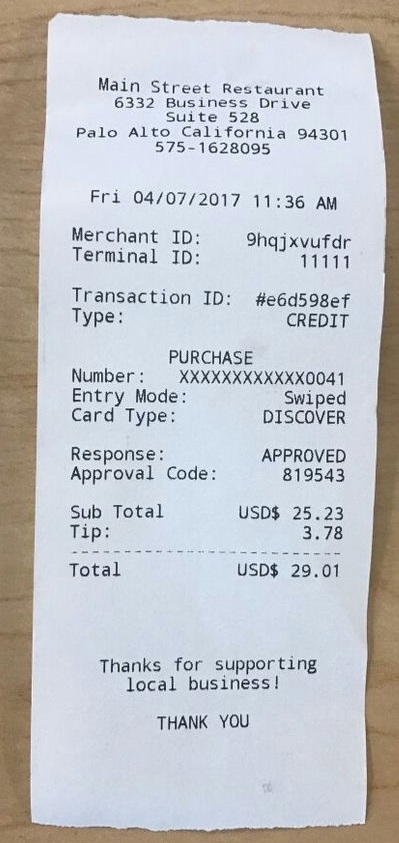
Identify the location of grain lines in wood table. (375, 792), (374, 733), (381, 679).